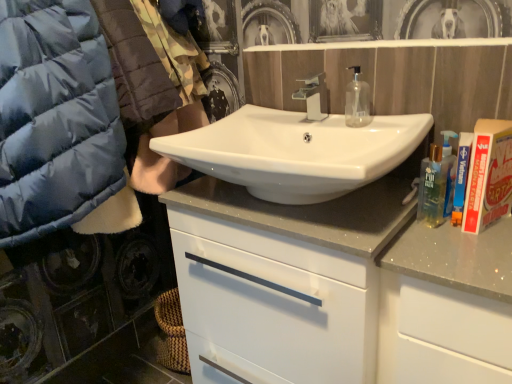
The height and width of the screenshot is (384, 512). I want to click on free point above white glossy cabinet at center (from a real-world perspective), so click(272, 204).